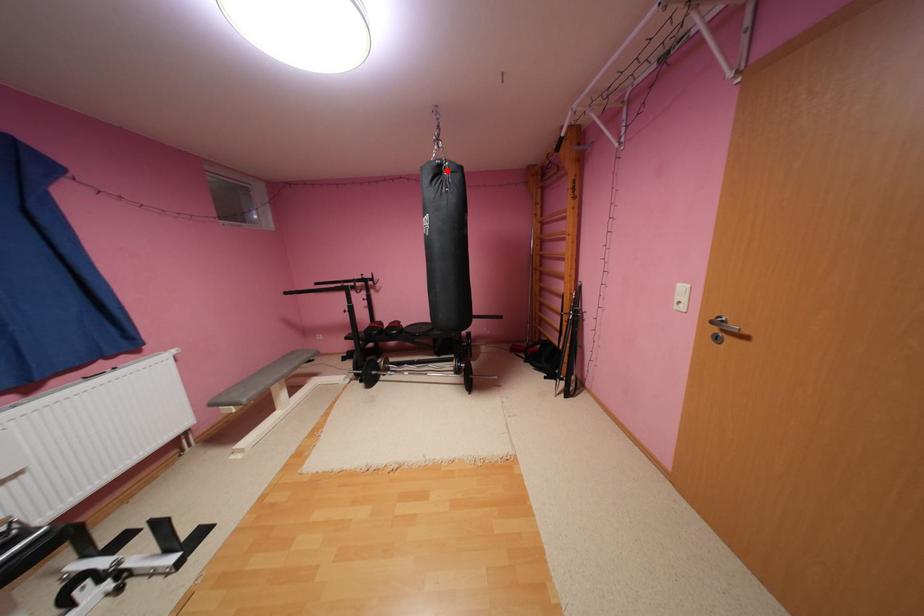
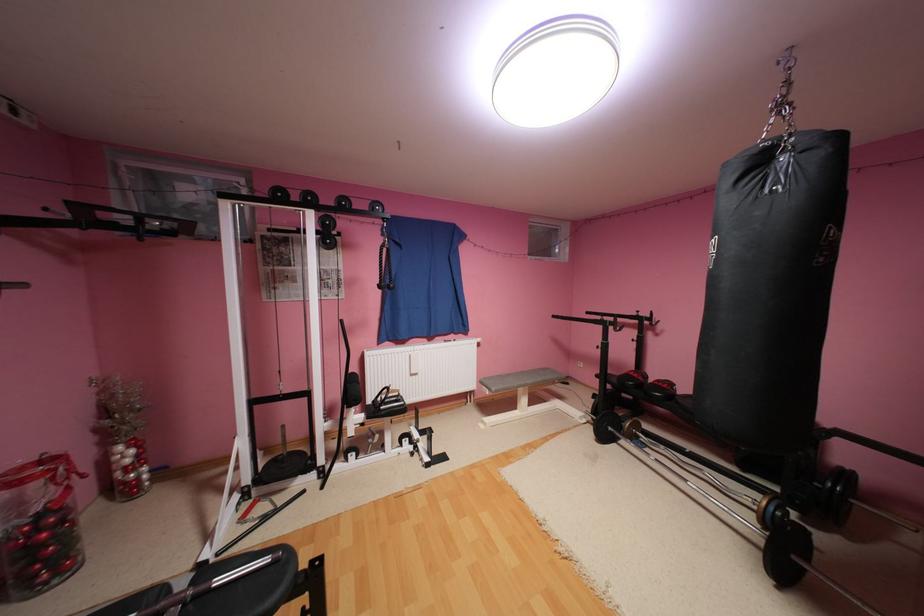
Question: I am providing you with two images of the same scene from different viewpoints. In image1, a red point is highlighted. Considering the same 3D point in image2, which of the following is correct?

Choices:
 (A) It is closer
 (B) It is farther

Answer: (B)